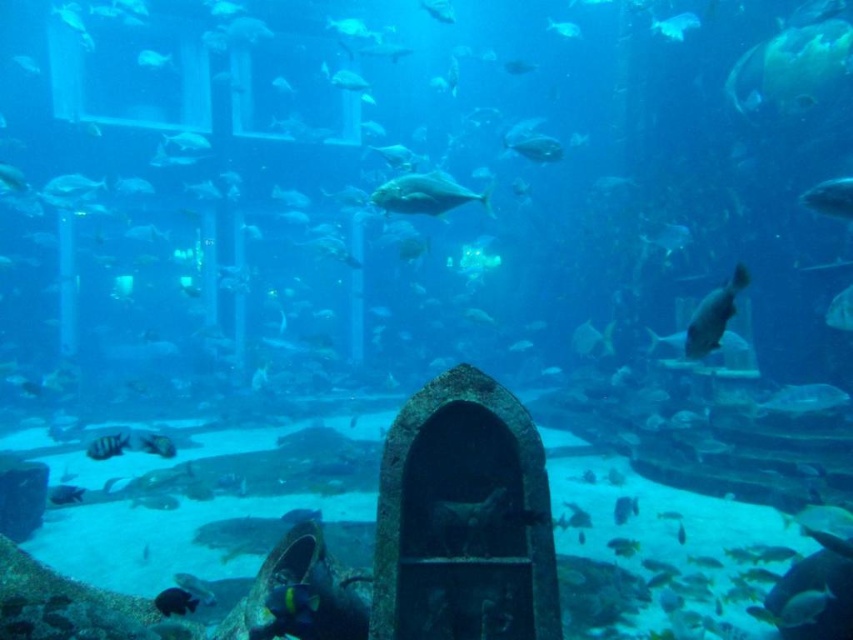
Which of these two, translucent blue fish at upper right or shiny black fish at lower left, stands shorter?

shiny black fish at lower left

Does point (811, 195) lie in front of point (180, 596)?

No.

Does point (811, 204) lie in front of point (160, 611)?

No, (811, 204) is further to viewer.

At what (x,y) coordinates should I click in order to perform the action: click on translucent blue fish at upper right. Please return your answer as a coordinate pair (x, y). The width and height of the screenshot is (853, 640). Looking at the image, I should click on (830, 196).

Who is higher up, shiny silver fish at center or shiny silver fish at right?

shiny silver fish at center is above.

Can you confirm if shiny silver fish at center is thinner than shiny silver fish at right?

No, shiny silver fish at center is not thinner than shiny silver fish at right.

Is point (422, 198) behind point (698, 321)?

Yes, it is.

Locate an element on the screen. The width and height of the screenshot is (853, 640). shiny silver fish at center is located at coordinates (424, 193).

Does point (451, 208) lie in front of point (808, 200)?

No, it is behind (808, 200).

What do you see at coordinates (424, 193) in the screenshot? The image size is (853, 640). I see `shiny silver fish at center` at bounding box center [424, 193].

Where is `shiny silver fish at center`? shiny silver fish at center is located at coordinates (424, 193).